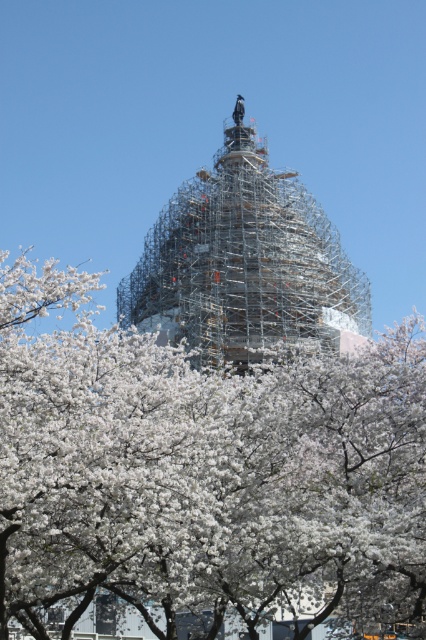
Does point (155, 497) lie in front of point (227, 248)?

Yes, point (155, 497) is in front of point (227, 248).

Is white blossoms at center thinner than scaffolding at center?

No.

Who is more forward, (103, 515) or (322, 268)?

Point (103, 515)

At what (x,y) coordinates should I click in order to perform the action: click on white blossoms at center. Please return your answer as a coordinate pair (x, y). Looking at the image, I should click on (204, 476).